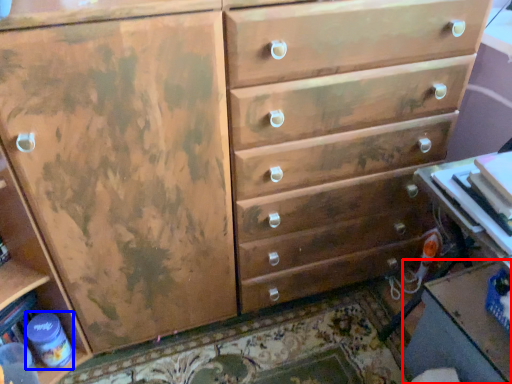
Question: Among these objects, which one is nearest to the camera, table (highlighted by a red box) or bottle (highlighted by a blue box)?

Choices:
 (A) table
 (B) bottle

Answer: (A)